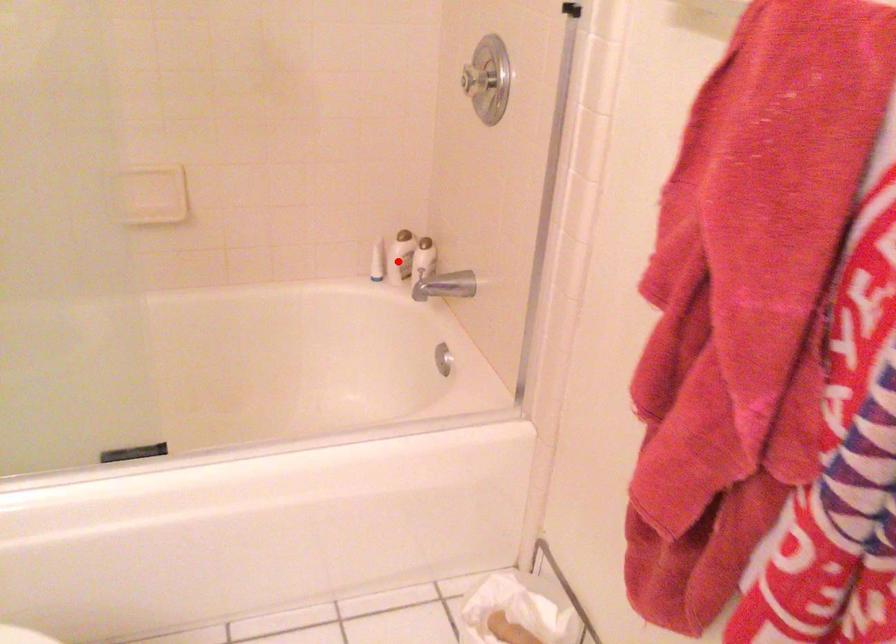
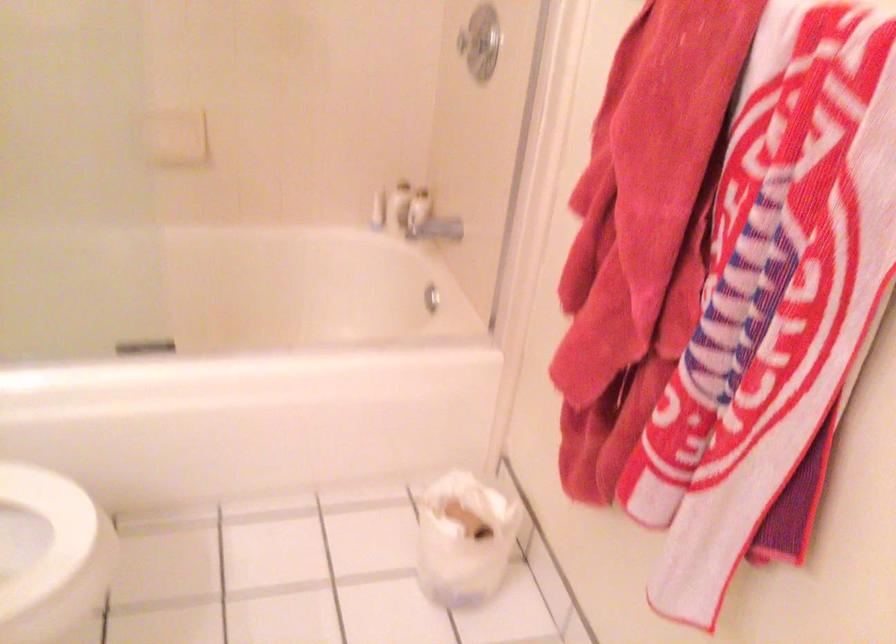
Locate, in the second image, the point that corresponds to the highlighted location in the first image.

(399, 205)